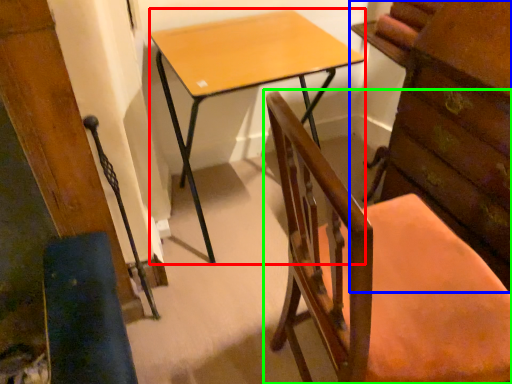
Question: Based on their relative distances, which object is farther from desk (highlighted by a red box)? Choose from chest of drawers (highlighted by a blue box) and chair (highlighted by a green box).

Choices:
 (A) chest of drawers
 (B) chair

Answer: (B)